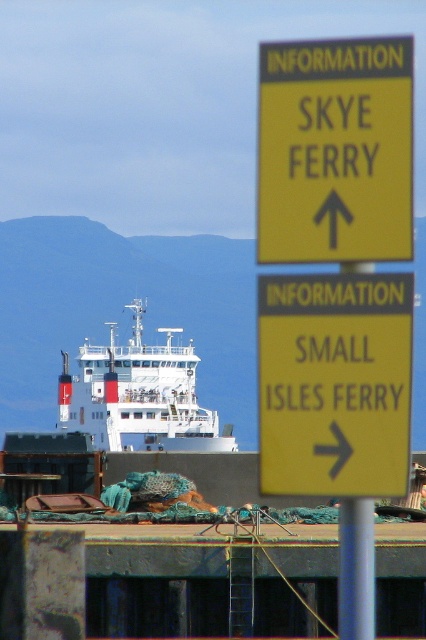
You are standing at the harbor and want to locate the yellow paper sign at upper center. According to the scene, where should you look in relation to the white matte ship at center?

The yellow paper sign at upper center is located to the right of the white matte ship at center.